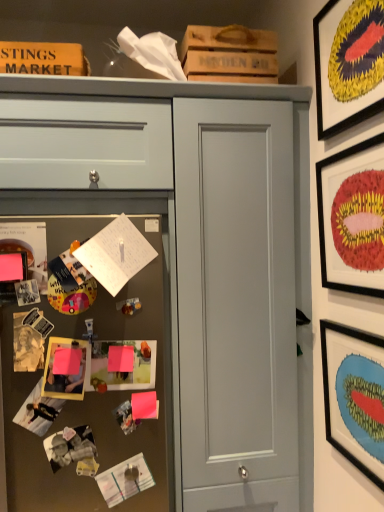
The image size is (384, 512). I want to click on black matte picture frame at upper right, the fourth picture frame from the top, so click(x=354, y=396).

Locate an element on the screen. The width and height of the screenshot is (384, 512). metallic silver fridge at left is located at coordinates (91, 390).

The width and height of the screenshot is (384, 512). What do you see at coordinates (352, 218) in the screenshot?
I see `matte black picture frame at upper right, marked as the 2th picture frame in a top-to-bottom arrangement` at bounding box center [352, 218].

The width and height of the screenshot is (384, 512). What do you see at coordinates (115, 254) in the screenshot?
I see `white paper at left` at bounding box center [115, 254].

Locate an element on the screen. matte yellow picture frame at lower left, which is counted as the 3th picture frame, starting from the top is located at coordinates (65, 369).

In the scene shown: Is black matte picture frame at upper right, the fourth picture frame from the top, facing away from matte black picture frame at upper right, the third picture frame viewed from the right?

No, black matte picture frame at upper right, the fourth picture frame from the top, is not facing the opposite direction of matte black picture frame at upper right, the third picture frame viewed from the right.

What's the angular difference between black matte picture frame at upper right, the fourth picture frame from the top, and matte black picture frame at upper right, the 2th picture frame positioned from the left,'s facing directions?

black matte picture frame at upper right, the fourth picture frame from the top, and matte black picture frame at upper right, the 2th picture frame positioned from the left, are facing 0.00258 degrees away from each other.

Who is smaller, black matte picture frame at upper right, the first picture frame positioned from the bottom, or matte black picture frame at upper right, marked as the 2th picture frame in a top-to-bottom arrangement?

With smaller size is black matte picture frame at upper right, the first picture frame positioned from the bottom.

Between black matte picture frame at upper right, the first picture frame positioned from the bottom, and matte black picture frame at upper right, the third picture frame ordered from the bottom, which one has smaller width?

black matte picture frame at upper right, the first picture frame positioned from the bottom.

Considering the relative sizes of matte gray door at center and white paper at left in the image provided, is matte gray door at center thinner than white paper at left?

No.

Which is more distant, (283, 415) or (124, 270)?

Positioned behind is point (283, 415).

Is matte gray door at center bigger than white paper at left?

Indeed, matte gray door at center has a larger size compared to white paper at left.

Who is more distant, matte gray door at center or white paper at left?

matte gray door at center is behind.

Between matte black picture frame at upper right, the third picture frame ordered from the bottom, and metallic silver fridge at left, which one has larger size?

metallic silver fridge at left is bigger.

Considering the relative sizes of matte black picture frame at upper right, marked as the 2th picture frame in a top-to-bottom arrangement, and metallic silver fridge at left in the image provided, is matte black picture frame at upper right, marked as the 2th picture frame in a top-to-bottom arrangement, wider than metallic silver fridge at left?

No, matte black picture frame at upper right, marked as the 2th picture frame in a top-to-bottom arrangement, is not wider than metallic silver fridge at left.

How many degrees apart are the facing directions of matte black picture frame at upper right, marked as the 2th picture frame in a top-to-bottom arrangement, and metallic silver fridge at left?

There is a 90-degree angle between the facing directions of matte black picture frame at upper right, marked as the 2th picture frame in a top-to-bottom arrangement, and metallic silver fridge at left.

Who is bigger, matte yellow picture frame at lower left, the 1th picture frame when ordered from left to right, or matte black picture frame at upper right, marked as the 2th picture frame in a top-to-bottom arrangement?

matte black picture frame at upper right, marked as the 2th picture frame in a top-to-bottom arrangement.

Considering the positions of point (60, 354) and point (363, 216), is point (60, 354) closer or farther from the camera than point (363, 216)?

Point (60, 354) appears to be farther away from the viewer than point (363, 216).

From a real-world perspective, is matte yellow picture frame at lower left, which is counted as the 3th picture frame, starting from the top, physically located above or below matte black picture frame at upper right, the third picture frame ordered from the bottom?

matte yellow picture frame at lower left, which is counted as the 3th picture frame, starting from the top, is situated lower than matte black picture frame at upper right, the third picture frame ordered from the bottom, in the real world.

Considering the relative sizes of matte yellow picture frame at lower left, which is the 4th picture frame from right to left, and matte black picture frame at upper right, the 2th picture frame positioned from the left, in the image provided, is matte yellow picture frame at lower left, which is the 4th picture frame from right to left, wider than matte black picture frame at upper right, the 2th picture frame positioned from the left,?

Yes.

Between metallic silver fridge at left and white paper at left, which one has more height?

With more height is metallic silver fridge at left.

From the image's perspective, is metallic silver fridge at left located above or below white paper at left?

metallic silver fridge at left is situated lower than white paper at left in the image.

Based on their sizes in the image, would you say metallic silver fridge at left is bigger or smaller than white paper at left?

In the image, metallic silver fridge at left appears to be larger than white paper at left.

From the picture: Is there a large distance between metallic silver fridge at left and white paper at left?

No.

Is white paper at left oriented away from matte gray drawer at upper left?

No, white paper at left is not facing away from matte gray drawer at upper left.

Is white paper at left outside of matte gray drawer at upper left?

white paper at left lies outside matte gray drawer at upper left's area.

Is white paper at left far away from matte gray drawer at upper left?

No.

Considering the relative sizes of matte black picture frame at upper right, marked as the 2th picture frame in a top-to-bottom arrangement, and wooden framed artwork at upper right, placed as the third picture frame when sorted from left to right, in the image provided, is matte black picture frame at upper right, marked as the 2th picture frame in a top-to-bottom arrangement, thinner than wooden framed artwork at upper right, placed as the third picture frame when sorted from left to right,?

No.

Which of these two, matte black picture frame at upper right, the 2th picture frame positioned from the left, or wooden framed artwork at upper right, the 1th picture frame when ordered from top to bottom, stands taller?

Standing taller between the two is wooden framed artwork at upper right, the 1th picture frame when ordered from top to bottom.

Locate an element on the screen. The height and width of the screenshot is (512, 384). picture frame that is the 1st object to the right of the matte black picture frame at upper right, the 2th picture frame positioned from the left, starting at the anchor is located at coordinates (348, 63).

Based on the photo, is matte black picture frame at upper right, marked as the 2th picture frame in a top-to-bottom arrangement, positioned with its back to wooden framed artwork at upper right, placed as the third picture frame when sorted from left to right?

No, matte black picture frame at upper right, marked as the 2th picture frame in a top-to-bottom arrangement, is not facing the opposite direction of wooden framed artwork at upper right, placed as the third picture frame when sorted from left to right.

From a real-world perspective, count 2nd picture frames upward from the black matte picture frame at upper right, which ranks as the 1th picture frame in right-to-left order, and point to it. Please provide its 2D coordinates.

[(352, 218)]

Locate an element on the screen. door behind the white paper at left is located at coordinates (236, 304).

Considering their positions, is black matte picture frame at upper right, arranged as the 4th picture frame when viewed from the left, positioned closer to wooden framed artwork at upper right, placed as the third picture frame when sorted from left to right, than matte yellow picture frame at lower left, which is the 4th picture frame from right to left?

black matte picture frame at upper right, arranged as the 4th picture frame when viewed from the left.

Considering their positions, is matte gray drawer at upper left positioned closer to matte black picture frame at upper right, the third picture frame viewed from the right, than black matte picture frame at upper right, which ranks as the 1th picture frame in right-to-left order?

black matte picture frame at upper right, which ranks as the 1th picture frame in right-to-left order, is positioned closer to the anchor matte black picture frame at upper right, the third picture frame viewed from the right.

Estimate the real-world distances between objects in this image. Which object is closer to wooden framed artwork at upper right, the fourth picture frame positioned from the bottom, matte gray drawer at upper left or matte black picture frame at upper right, marked as the 2th picture frame in a top-to-bottom arrangement?

matte black picture frame at upper right, marked as the 2th picture frame in a top-to-bottom arrangement.

Looking at the image, which one is located closer to matte yellow picture frame at lower left, which is the 4th picture frame from right to left, matte black picture frame at upper right, the third picture frame ordered from the bottom, or white paper at left?

white paper at left lies closer to matte yellow picture frame at lower left, which is the 4th picture frame from right to left, than the other object.

From the picture: From the image, which object appears to be nearer to white paper at left, matte black picture frame at upper right, the third picture frame ordered from the bottom, or black matte picture frame at upper right, the fourth picture frame from the top?

matte black picture frame at upper right, the third picture frame ordered from the bottom, is closer to white paper at left.

Based on their spatial positions, is matte gray drawer at upper left or matte gray door at center closer to white paper at left?

The object closer to white paper at left is matte gray drawer at upper left.

Looking at the image, which one is located closer to white paper at left, matte black picture frame at upper right, the third picture frame viewed from the right, or matte gray drawer at upper left?

matte gray drawer at upper left is positioned closer to the anchor white paper at left.

Based on their spatial positions, is metallic silver fridge at left or black matte picture frame at upper right, the fourth picture frame from the top, further from matte gray drawer at upper left?

black matte picture frame at upper right, the fourth picture frame from the top, is positioned further to the anchor matte gray drawer at upper left.

Where is `door between metallic silver fridge at left and matte black picture frame at upper right, the third picture frame ordered from the bottom`? This screenshot has height=512, width=384. door between metallic silver fridge at left and matte black picture frame at upper right, the third picture frame ordered from the bottom is located at coordinates (236, 304).

Identify the location of card between wooden framed artwork at upper right, the fourth picture frame positioned from the bottom, and matte gray door at center from top to bottom. (115, 254).

The image size is (384, 512). Find the location of `fridge situated between matte yellow picture frame at lower left, which is the 4th picture frame from right to left, and matte black picture frame at upper right, marked as the 2th picture frame in a top-to-bottom arrangement, from left to right`. fridge situated between matte yellow picture frame at lower left, which is the 4th picture frame from right to left, and matte black picture frame at upper right, marked as the 2th picture frame in a top-to-bottom arrangement, from left to right is located at coordinates (91, 390).

This screenshot has width=384, height=512. In order to click on card located between matte yellow picture frame at lower left, which is the 4th picture frame from right to left, and black matte picture frame at upper right, which ranks as the 1th picture frame in right-to-left order, in the left-right direction in this screenshot , I will do `click(115, 254)`.